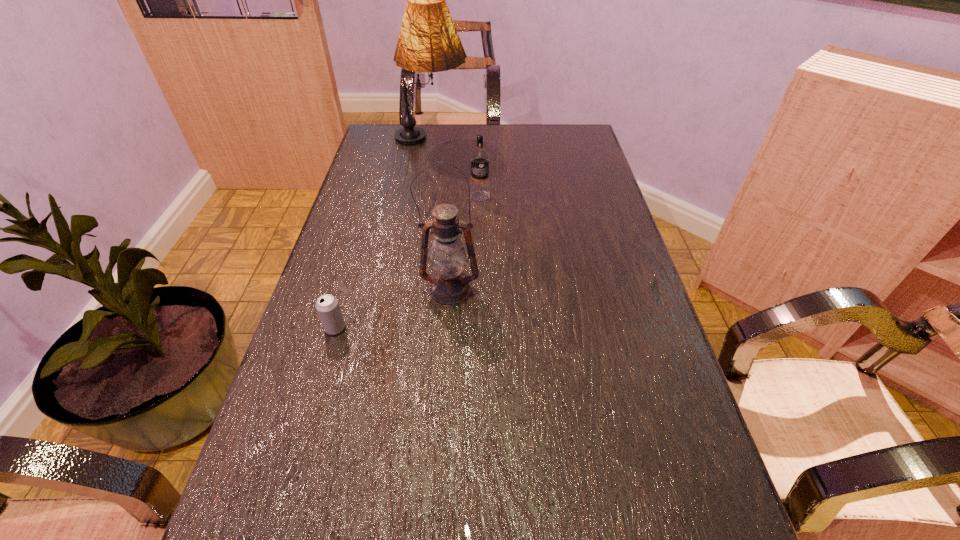
Find the location of `the tallest object`. the tallest object is located at coordinates (428, 41).

Where is `lampshade`? The image size is (960, 540). lampshade is located at coordinates (428, 41).

This screenshot has width=960, height=540. In order to click on the fourth shortest object in this screenshot , I will do `click(449, 287)`.

Locate an element on the screen. The height and width of the screenshot is (540, 960). oil lamp is located at coordinates (449, 287).

You are a GUI agent. You are given a task and a screenshot of the screen. Output one action in this format:
    pyautogui.click(x=<x>, y=<y>)
    Task: Click on the third tallest object
    The width and height of the screenshot is (960, 540).
    Given the screenshot: What is the action you would take?
    pyautogui.click(x=479, y=191)

This screenshot has height=540, width=960. I want to click on vodka, so click(x=479, y=191).

You are a GUI agent. You are given a task and a screenshot of the screen. Output one action in this format:
    pyautogui.click(x=<x>, y=<y>)
    Task: Click on the second nearest object
    
    Given the screenshot: What is the action you would take?
    pyautogui.click(x=328, y=308)

What are the coordinates of `the fourth tallest object` in the screenshot? It's located at [x=328, y=308].

In order to click on free space located on the front-facing side of the tallest object in this screenshot , I will do `click(569, 141)`.

Image resolution: width=960 pixels, height=540 pixels. Find the location of `vacant space located on the front of the second tallest object`. vacant space located on the front of the second tallest object is located at coordinates (444, 386).